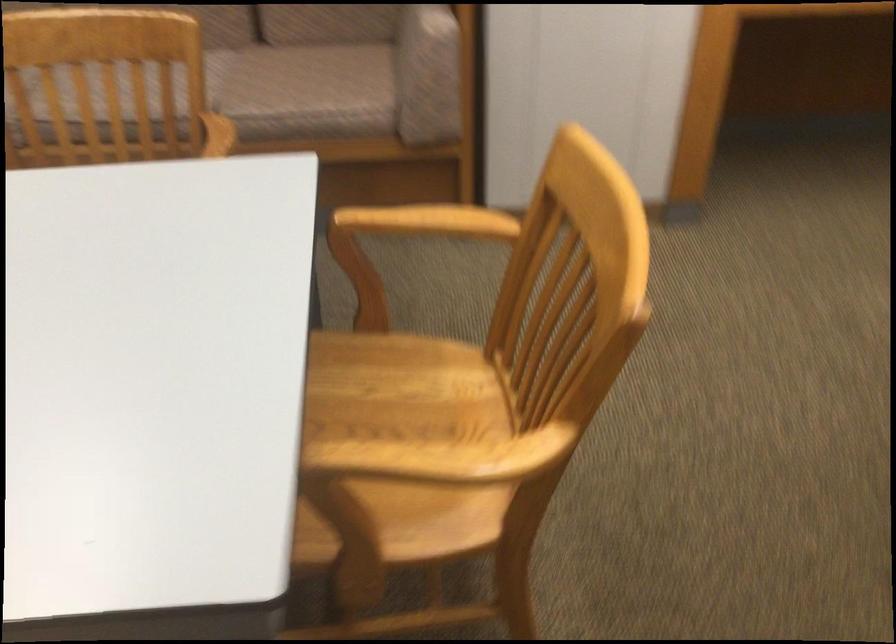
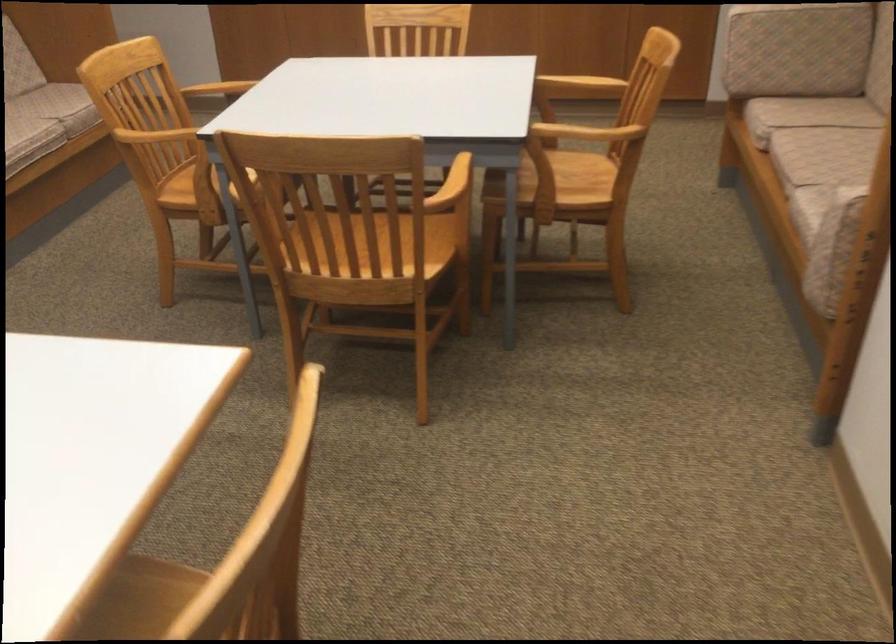
Locate, in the second image, the point that corresponds to (260,95) in the first image.

(822, 190)